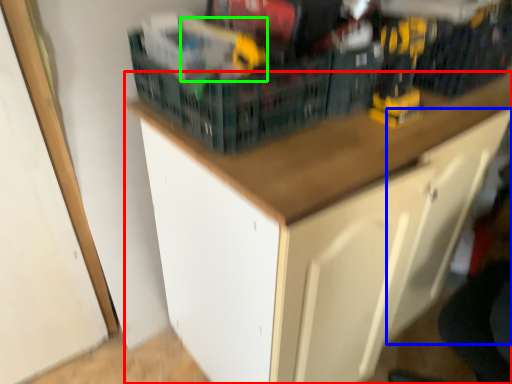
Question: Which object is the farthest from cabinetry (highlighted by a red box)? Choose among these: drawer (highlighted by a blue box) or toy (highlighted by a green box).

Choices:
 (A) drawer
 (B) toy

Answer: (B)